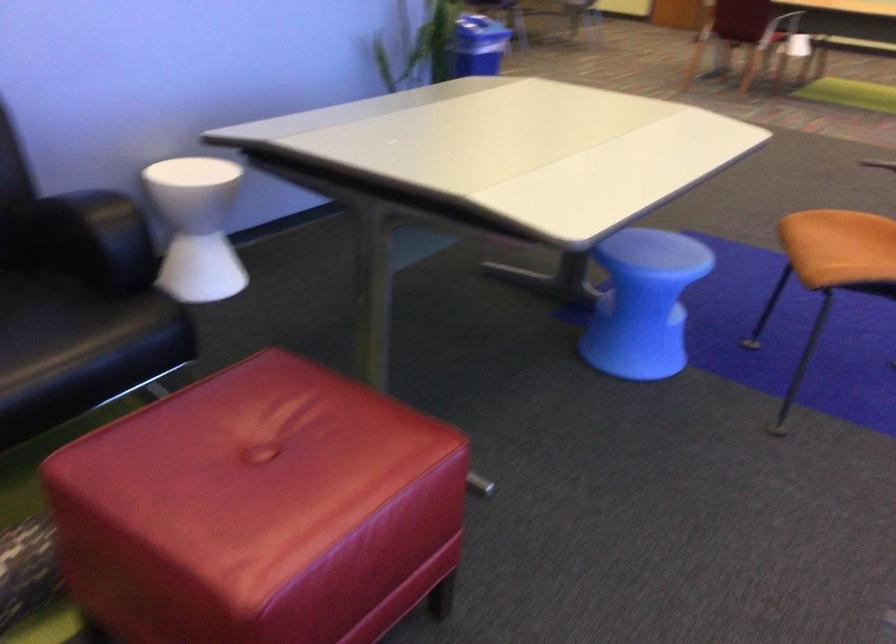
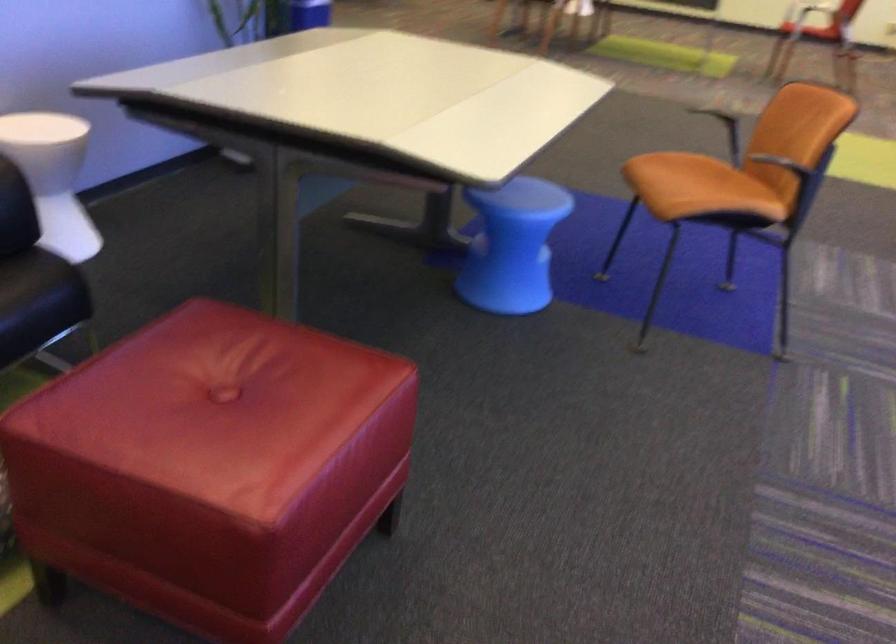
The point at (x=214, y=534) is marked in the first image. Where is the corresponding point in the second image?

(211, 466)